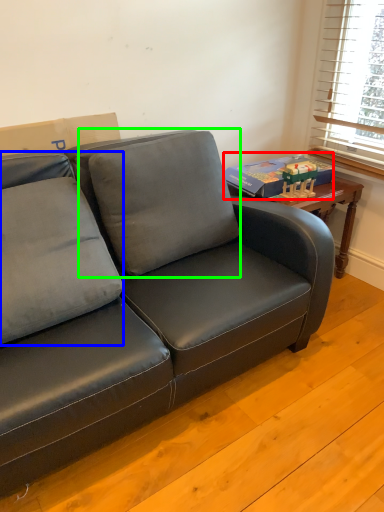
Question: Estimate the real-world distances between objects in this image. Which object is closer to paperback book (highlighted by a red box), pillow (highlighted by a blue box) or pillow (highlighted by a green box)?

Choices:
 (A) pillow
 (B) pillow

Answer: (B)